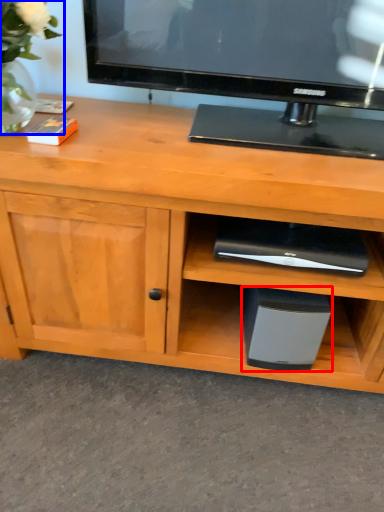
Question: Which of the following is the farthest to the observer, appliance (highlighted by a red box) or floral arrangement (highlighted by a blue box)?

Choices:
 (A) appliance
 (B) floral arrangement

Answer: (A)